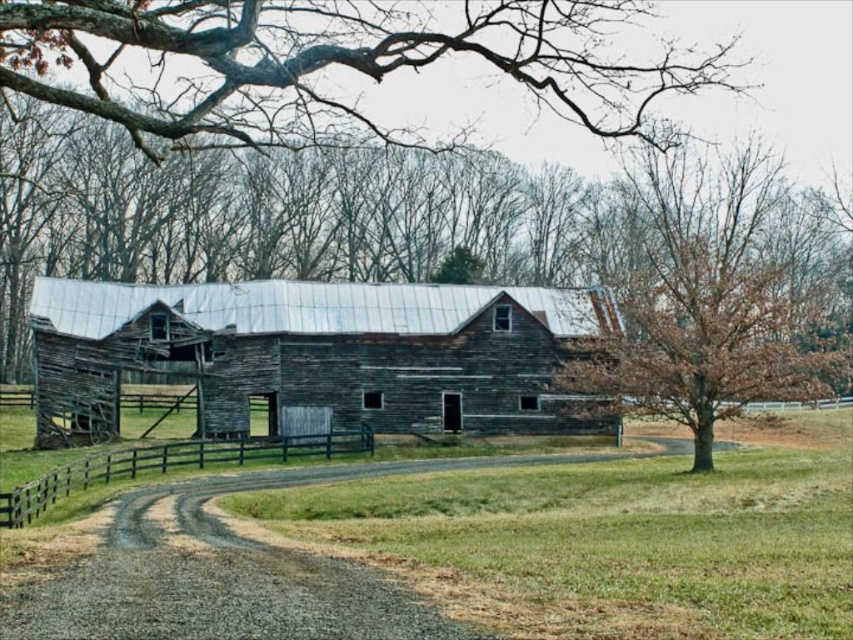
Does weathered wood barn at center have a larger size compared to gray gravel road at lower left?

Indeed, weathered wood barn at center has a larger size compared to gray gravel road at lower left.

Is weathered wood barn at center taller than gray gravel road at lower left?

Yes, weathered wood barn at center is taller than gray gravel road at lower left.

Where is `weathered wood barn at center`? The width and height of the screenshot is (853, 640). weathered wood barn at center is located at coordinates (318, 352).

Can you confirm if brown textured tree at right is taller than gray gravel road at lower left?

Correct, brown textured tree at right is much taller as gray gravel road at lower left.

Can you confirm if brown textured tree at right is smaller than gray gravel road at lower left?

No.

Find the location of a particular element. Image resolution: width=853 pixels, height=640 pixels. brown textured tree at right is located at coordinates (712, 292).

Is gray gravel road at lower left closer to the viewer compared to black wooden fence at lower center?

That is True.

Does gray gravel road at lower left have a lesser height compared to black wooden fence at lower center?

No.

Which is in front, point (202, 604) or point (42, 488)?

Point (202, 604)

Locate an element on the screen. Image resolution: width=853 pixels, height=640 pixels. gray gravel road at lower left is located at coordinates (218, 577).